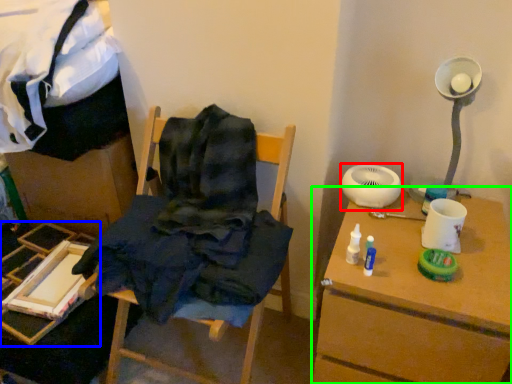
Question: Which object is positioned farthest from mechanical fan (highlighted by a red box)? Select from furniture (highlighted by a blue box) and table (highlighted by a green box).

Choices:
 (A) furniture
 (B) table

Answer: (A)